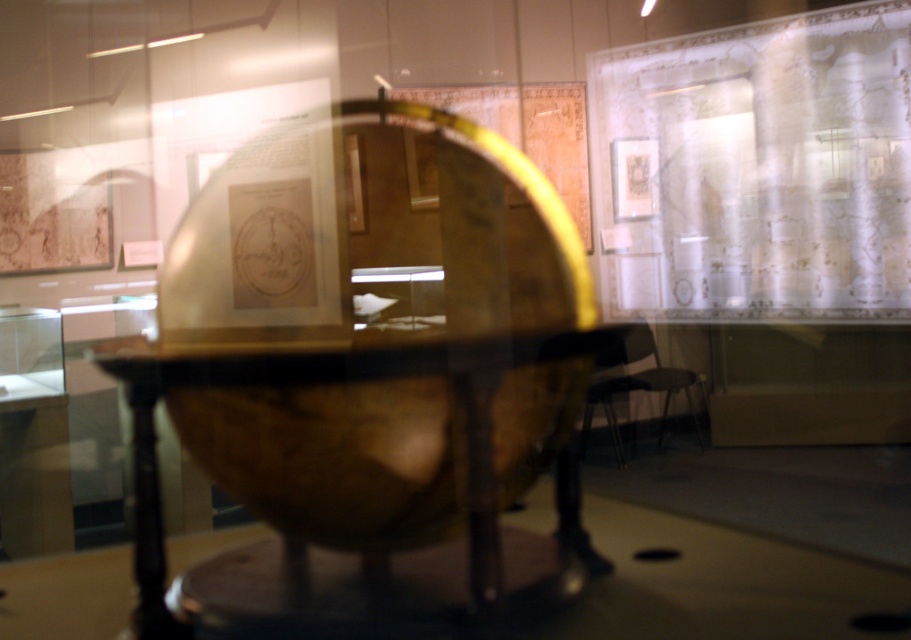
You are an art conservator tasked with cleaning the transparent wood globe at center. You need to reach the point at point (331, 381) to apply a protective coating. Given that the display case has a limited access opening at the bottom, can you safely reach that point without touching the glass?

The point (331, 381) is where the transparent wood globe at center is located. Since the display case has a glass that partially obscures and reflects light around the edges, it is likely that the access opening at the bottom allows reaching the center area. Therefore, the conservator can safely apply the coating at that point without touching the glass.

You are a visitor in the museum and want to sit on the matte black chair at center. Is the transparent wood globe at center blocking your way to the chair?

The transparent wood globe at center is above the matte black chair at center, so it is not blocking the path to the chair. You can sit on the matte black chair at center.

You are standing in the museum and want to touch the point at coordinates (x=306, y=356). Can you reach it without moving your position?

The point at coordinates (x=306, y=356) is 3.60 meters away from the viewer, so you cannot reach it without moving closer.